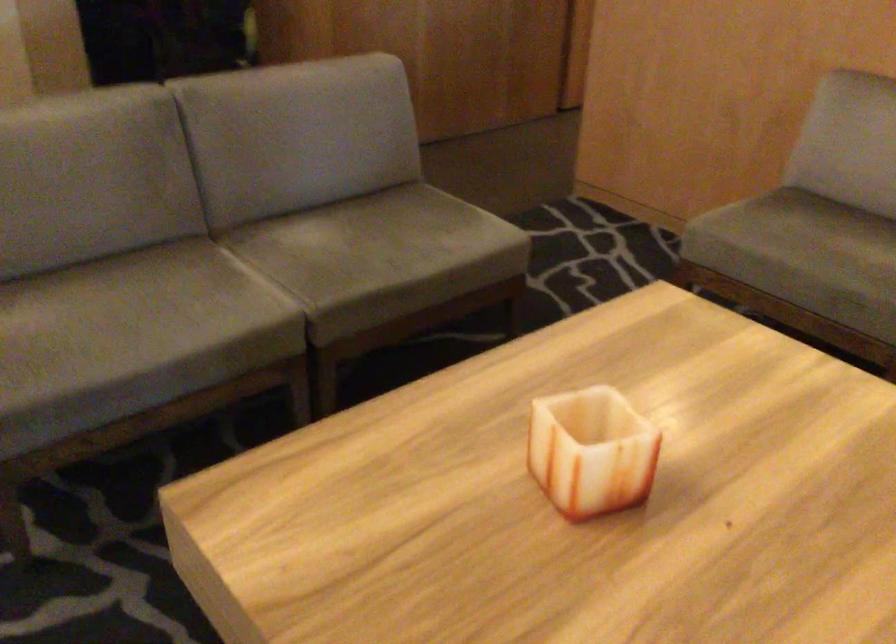
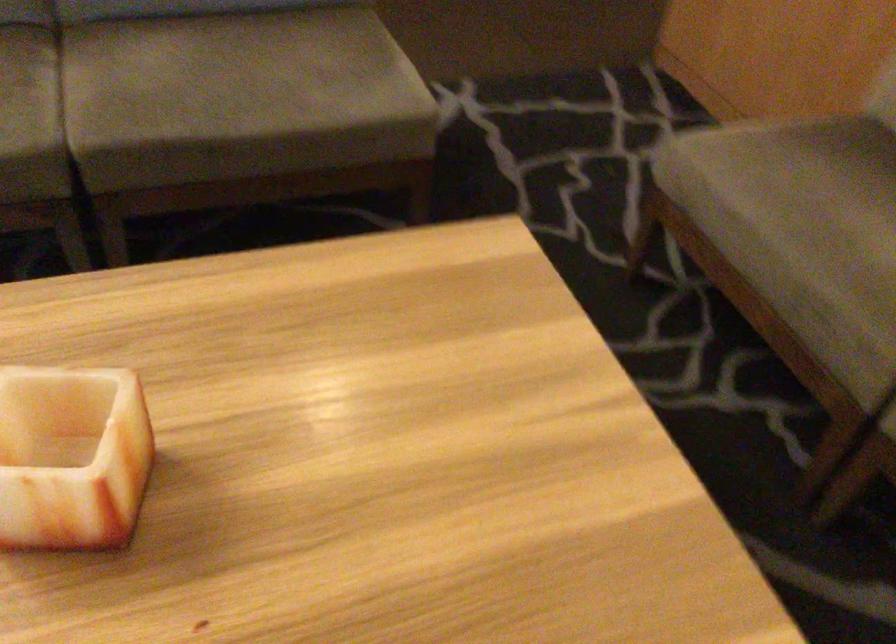
In a continuous first-person perspective shot, in which direction is the camera moving?

The movement direction of the cameraman is right, forward.